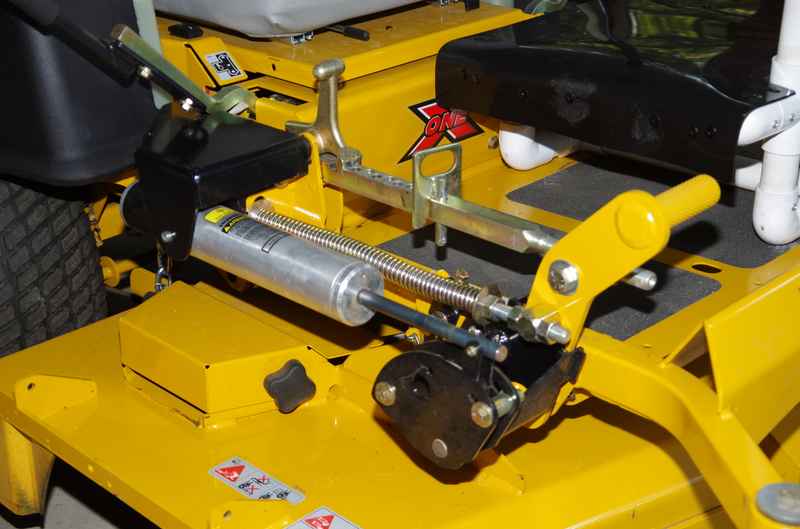
Identify the location of bracket. (42, 406), (305, 200), (762, 360).